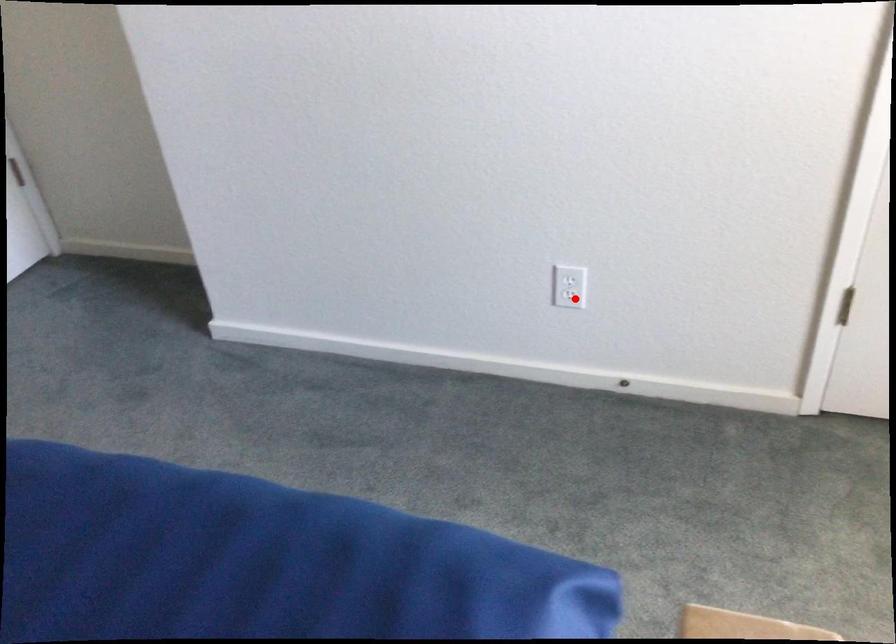
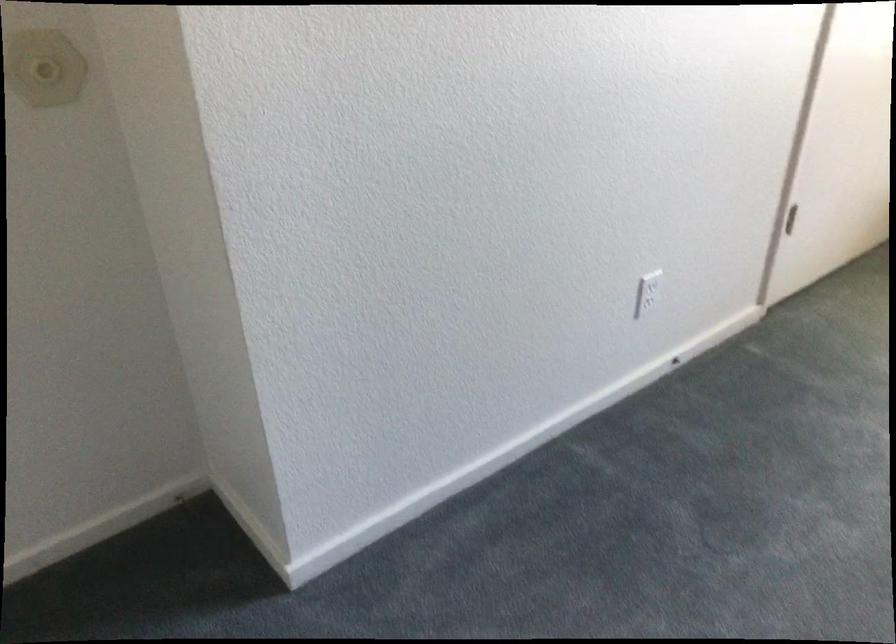
Where in the second image is the point corresponding to the highlighted location from the first image?

(645, 303)